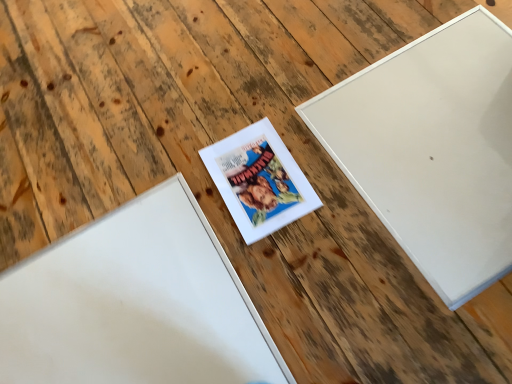
You are a GUI agent. You are given a task and a screenshot of the screen. Output one action in this format:
    pyautogui.click(x=<x>, y=<y>)
    Task: Click on the vacant space situated on the left part of white matte picture frame at upper right, which appears as the third picture frame when viewed from the left
    This screenshot has height=384, width=512.
    Given the screenshot: What is the action you would take?
    pyautogui.click(x=257, y=205)